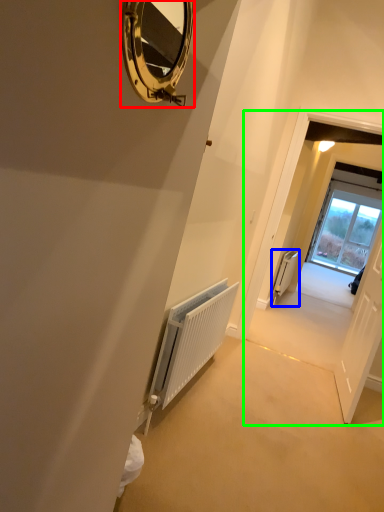
Question: Which is nearer to the mirror (highlighted by a red box)? radiator (highlighted by a blue box) or corridor (highlighted by a green box).

Choices:
 (A) radiator
 (B) corridor

Answer: (B)